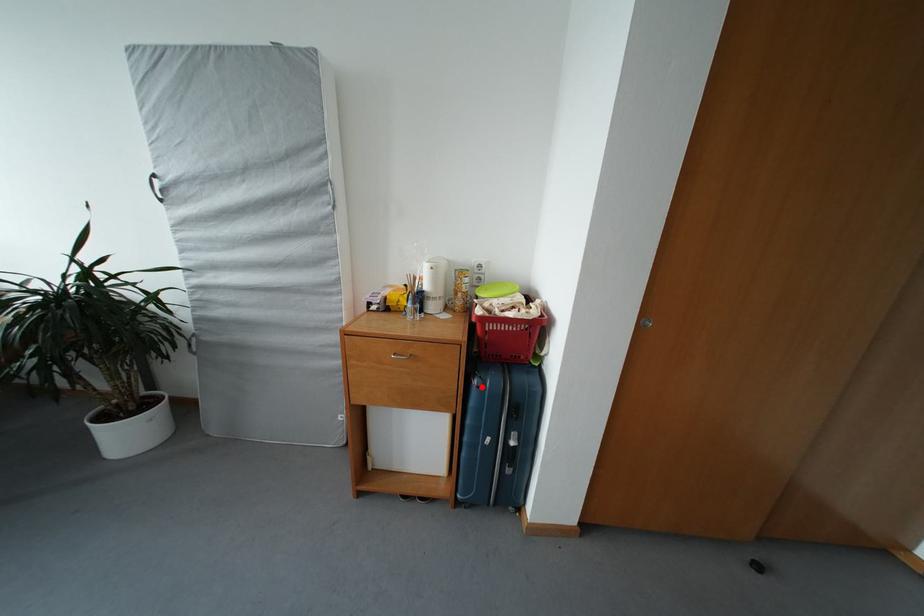
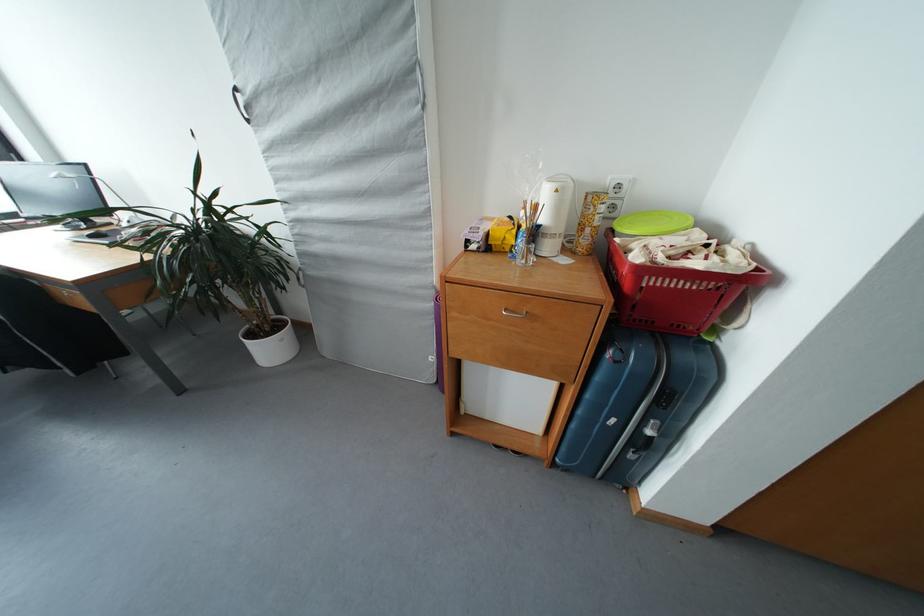
Locate, in the second image, the point that corresponds to the highlighted location in the first image.

(616, 359)